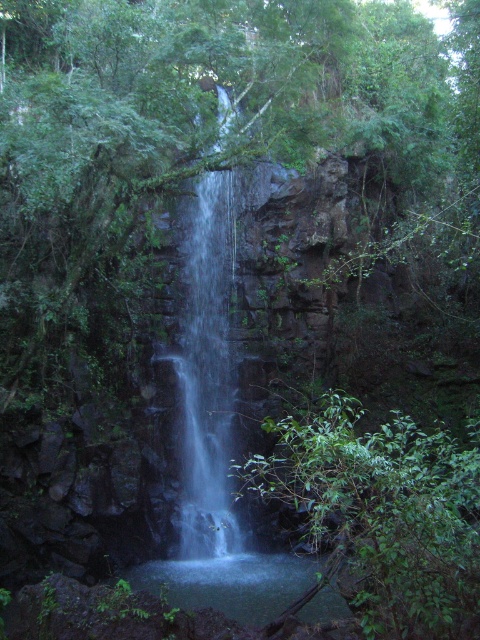
You are a hiker who wants to cross the clear water at center using a 3.5 meter long wooden plank. The green leafy tree at center is blocking your path. Can you place the plank between the two objects to cross?

The distance between the green leafy tree at center and the clear water at center is 3.55 meters. Since the wooden plank is only 3.5 meters long, it would be 5 centimeters too short to bridge the gap between the green leafy tree at center and the clear water at center. Therefore, you cannot place the plank to cross.

You are a hiker who wants to take a photo of the waterfall. You notice the green leafy tree at center and the clear water at center. Which object is closer to the camera, the tree or the water?

The green leafy tree at center is positioned under clear water at center, so the water is closer to the camera than the tree.

You are standing at the edge of the waterfall and notice a point marked at coordinates (384, 515). What is located at that point?

The point at coordinates (384, 515) indicates a green leafy tree at center.